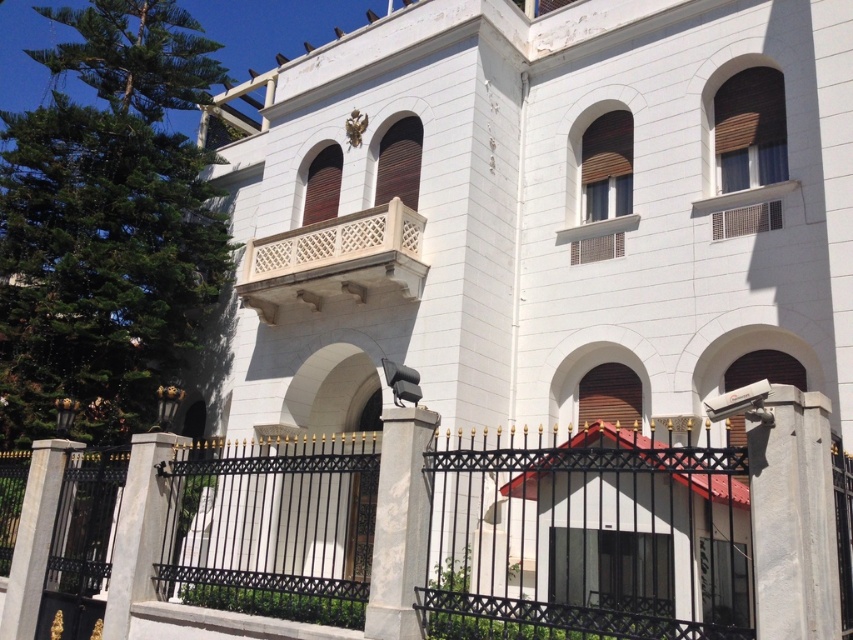
You are a painter who needs to set up an easel to paint the white stone balcony at center and the gray concrete pillar at lower left. Since you want to capture both objects in your painting, which object should you position your easel closer to in order to include both in your view?

You should position your easel closer to the gray concrete pillar at lower left because the white stone balcony at center is larger in size, so moving closer to the smaller object allows both to fit within the painting frame.

You are a maintenance worker needing to inspect both the gray concrete security camera at right and the white stone balcony at center. Given that you can only carry a 20 meter long ladder, will the ladder be sufficient to reach both locations from your current position?

The gray concrete security camera at right and white stone balcony at center are 20.09 meters apart from each other. Since the ladder is only 20 meters long, it is 9 centimeters short, so the ladder will not be sufficient to reach both locations from your current position.